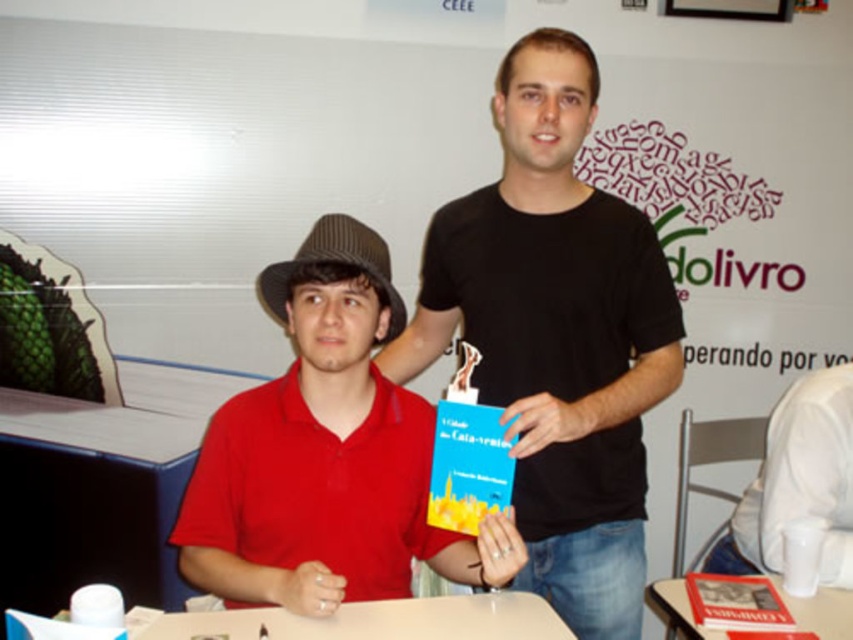
Question: Does white glossy table at center have a lesser width compared to brown woven cowboy hat at center?

Choices:
 (A) yes
 (B) no

Answer: (B)

Question: Can you confirm if matte red shirt at center is positioned above white glossy table at lower right?

Choices:
 (A) no
 (B) yes

Answer: (B)

Question: Which point is closer to the camera taking this photo?

Choices:
 (A) (254, 632)
 (B) (508, 285)
 (C) (686, 596)
 (D) (280, 310)

Answer: (A)

Question: Does white glossy table at center have a lesser width compared to brown woven cowboy hat at center?

Choices:
 (A) yes
 (B) no

Answer: (B)

Question: Which of these objects is positioned closest to the white glossy table at center?

Choices:
 (A) matte red shirt at center
 (B) white glossy table at lower right
 (C) brown woven cowboy hat at center
 (D) black matte t-shirt at center

Answer: (A)

Question: Which object appears closest to the camera in this image?

Choices:
 (A) white glossy table at center
 (B) white glossy table at lower right
 (C) brown woven cowboy hat at center
 (D) black matte t-shirt at center

Answer: (A)